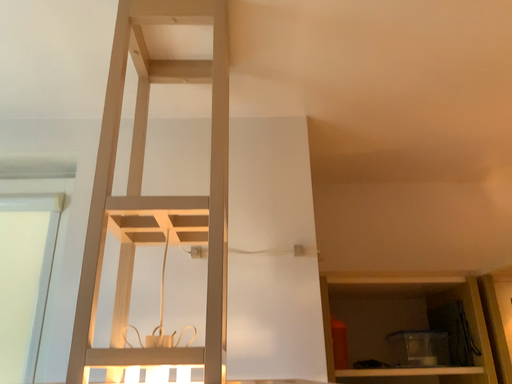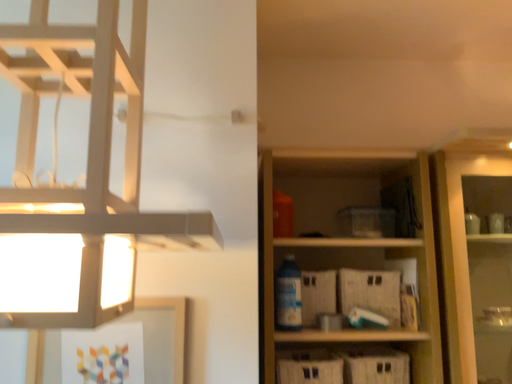
Question: How did the camera likely rotate when shooting the video?

Choices:
 (A) rotated downward
 (B) rotated upward

Answer: (A)